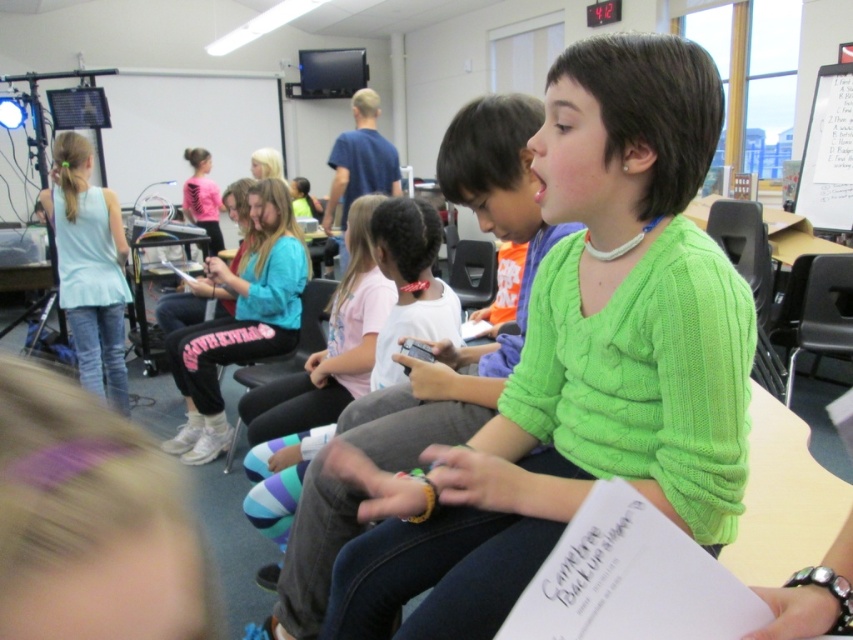
Question: Among these points, which one is nearest to the camera?

Choices:
 (A) (70, 275)
 (B) (354, 196)
 (C) (204, 445)

Answer: (C)

Question: Among these objects, which one is farthest from the camera?

Choices:
 (A) green knitted sweater at center
 (B) light blue fabric shirt at left
 (C) blue cotton shirt at center

Answer: (C)

Question: Which point appears farthest from the camera in this image?

Choices:
 (A) (x=286, y=227)
 (B) (x=350, y=186)
 (C) (x=579, y=97)
 (D) (x=78, y=179)

Answer: (B)

Question: Does pink fabric pants at center appear over light blue fabric shirt at left?

Choices:
 (A) yes
 (B) no

Answer: (B)

Question: Does green knitted sweater at center have a lesser width compared to blue cotton shirt at center?

Choices:
 (A) no
 (B) yes

Answer: (A)

Question: From the image, what is the correct spatial relationship of pink fabric pants at center in relation to blue cotton shirt at center?

Choices:
 (A) right
 (B) left

Answer: (B)